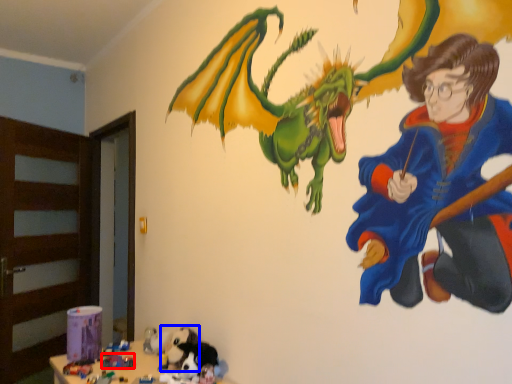
Question: Which object appears closest to the camera in this image, toy (highlighted by a red box) or animal (highlighted by a blue box)?

Choices:
 (A) toy
 (B) animal

Answer: (B)